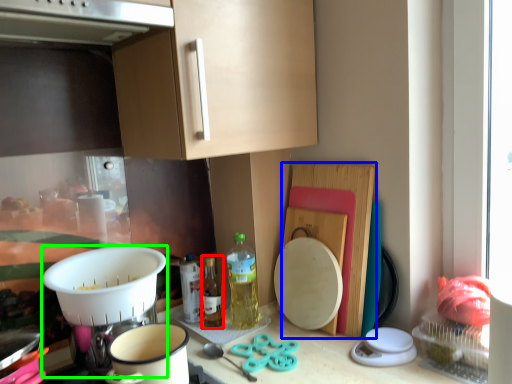
Question: Which is nearer to the bottle (highlighted by a red box)? cutting board (highlighted by a blue box) or appliance (highlighted by a green box).

Choices:
 (A) cutting board
 (B) appliance

Answer: (B)